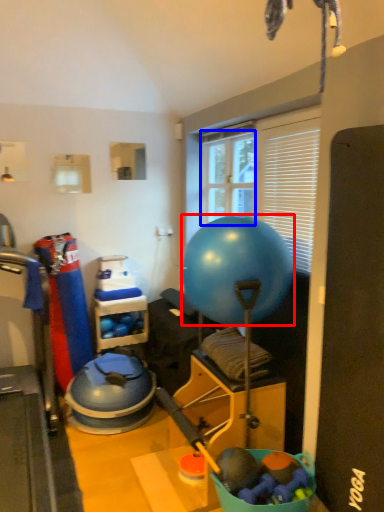
Question: Which of the following is the closest to the observer, ball (highlighted by a red box) or window screen (highlighted by a blue box)?

Choices:
 (A) ball
 (B) window screen

Answer: (A)